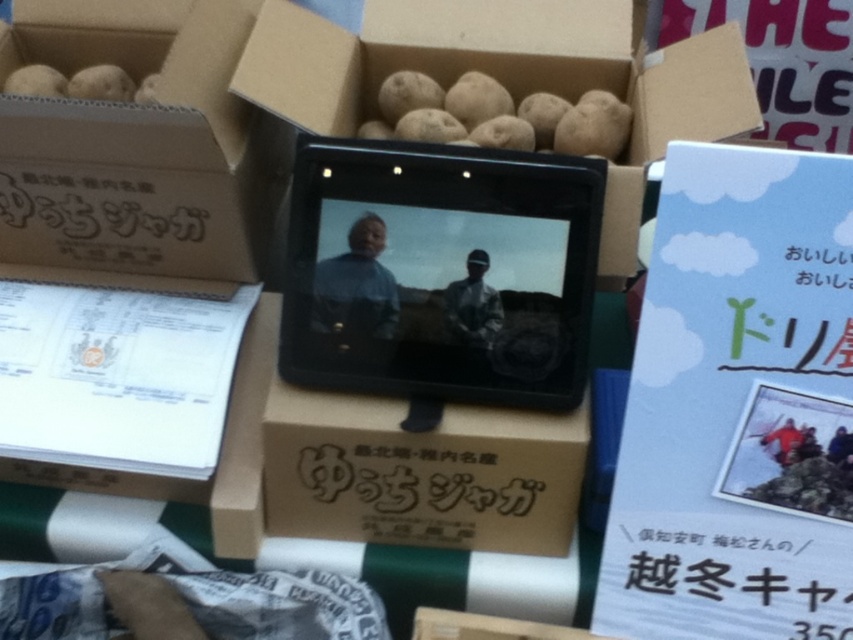
Question: Which of the following is the farthest from the observer?

Choices:
 (A) (48, 92)
 (B) (364, 124)

Answer: (B)

Question: Does matte cardboard box at center appear under white paper at lower right?

Choices:
 (A) yes
 (B) no

Answer: (B)

Question: Is brown cardboard box at upper left in front of smooth brown potatoes at upper left?

Choices:
 (A) no
 (B) yes

Answer: (B)

Question: Which point is closer to the camera taking this photo?

Choices:
 (A) (410, 134)
 (B) (28, 76)
 (C) (106, 77)

Answer: (A)

Question: Does matte cardboard box at center appear under smooth brown potato at upper left?

Choices:
 (A) yes
 (B) no

Answer: (A)

Question: Based on their relative distances, which object is nearer to the brown matte potatoes at upper center?

Choices:
 (A) brown cardboard box at upper left
 (B) smooth brown potatoes at upper left
 (C) matte cardboard box at center

Answer: (C)